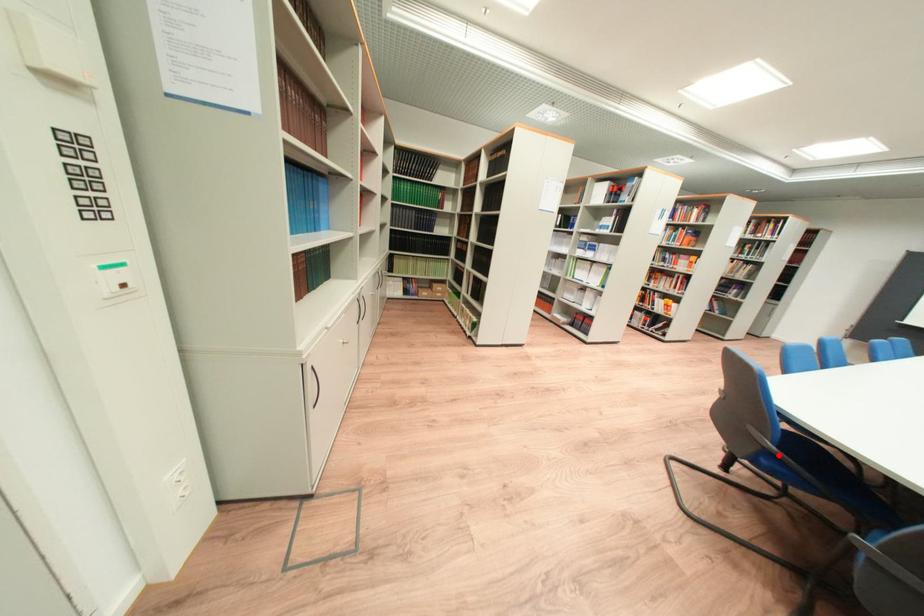
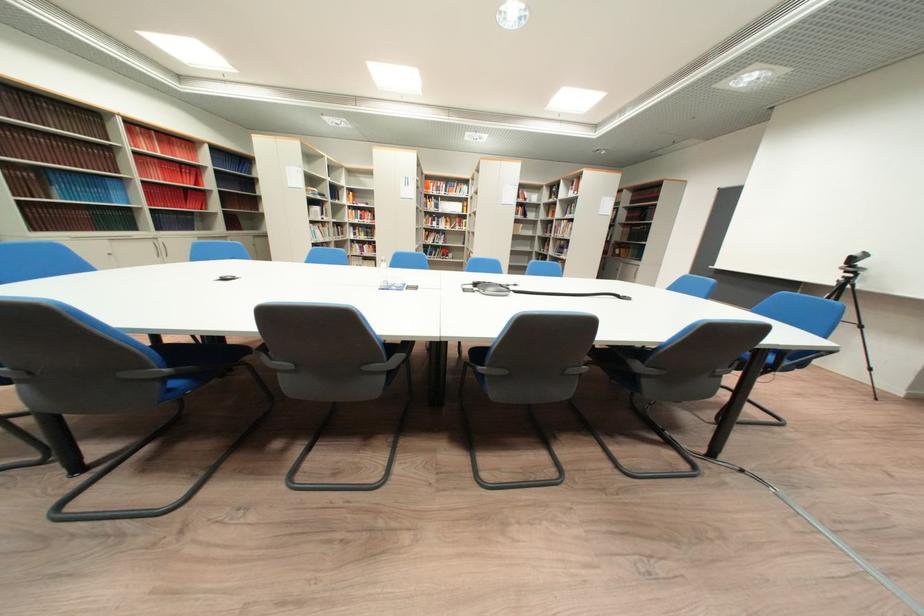
Question: I am providing you with two images of the same scene from different viewpoints. A red point is marked on the first image. At the location where the point appears in image 1, is it still visible in image 2?

Choices:
 (A) Yes
 (B) No

Answer: (B)